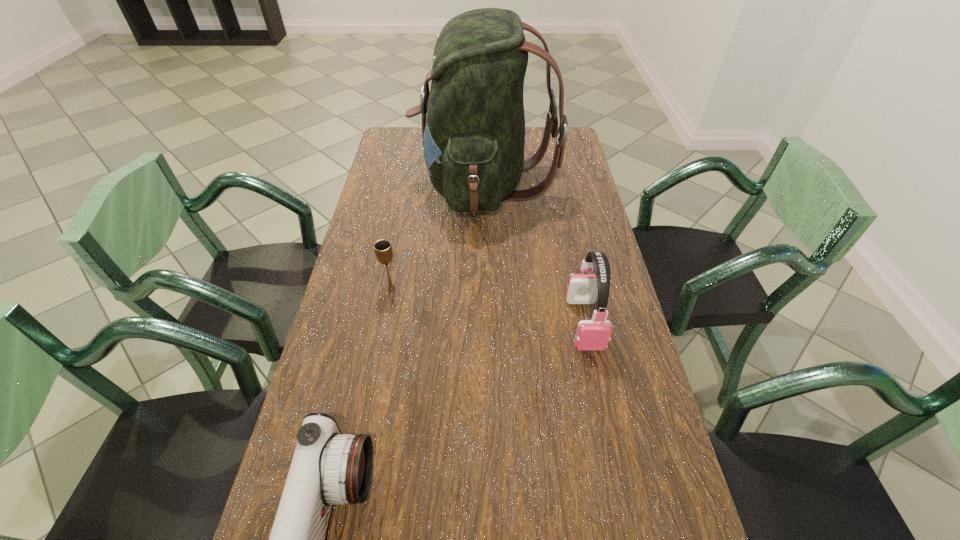
At what (x,y) coordinates should I click in order to perform the action: click on vacant point located between the tallest object and the chalice. Please return your answer as a coordinate pair (x, y). Looking at the image, I should click on (438, 237).

Where is `object that is the second closest one to the camcorder`? The width and height of the screenshot is (960, 540). object that is the second closest one to the camcorder is located at coordinates (592, 335).

Identify the location of object identified as the third closest to the chalice. This screenshot has width=960, height=540. (592, 335).